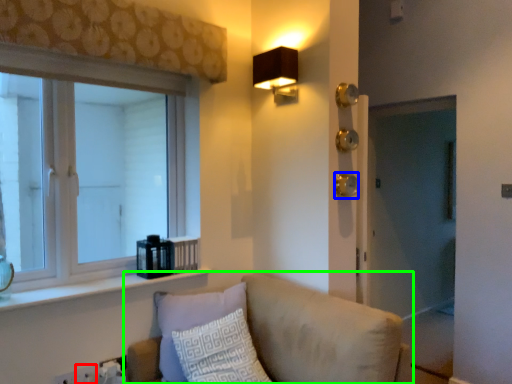
Question: Which object is the farthest from electric outlet (highlighted by a red box)? Choose among these: door handle (highlighted by a blue box) or studio couch (highlighted by a green box).

Choices:
 (A) door handle
 (B) studio couch

Answer: (A)